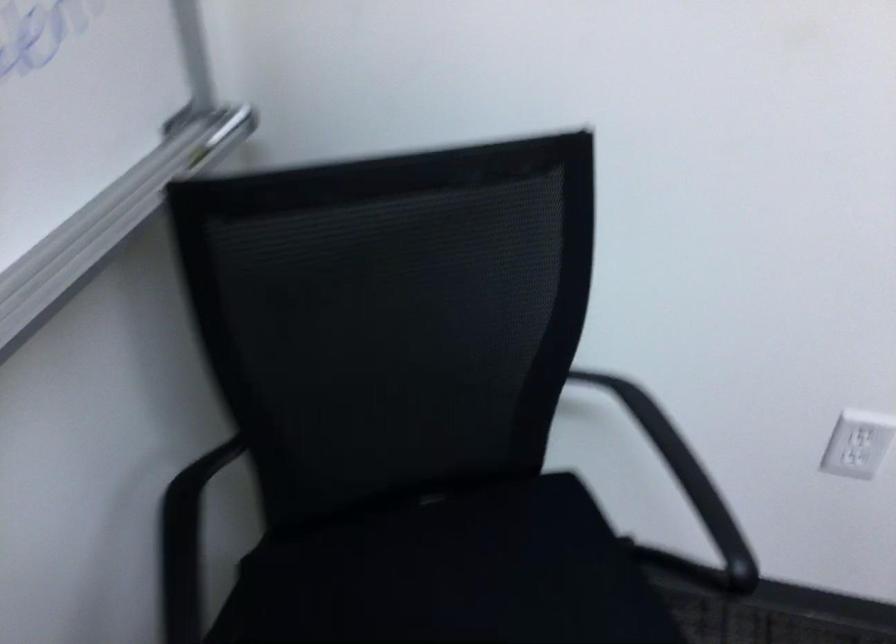
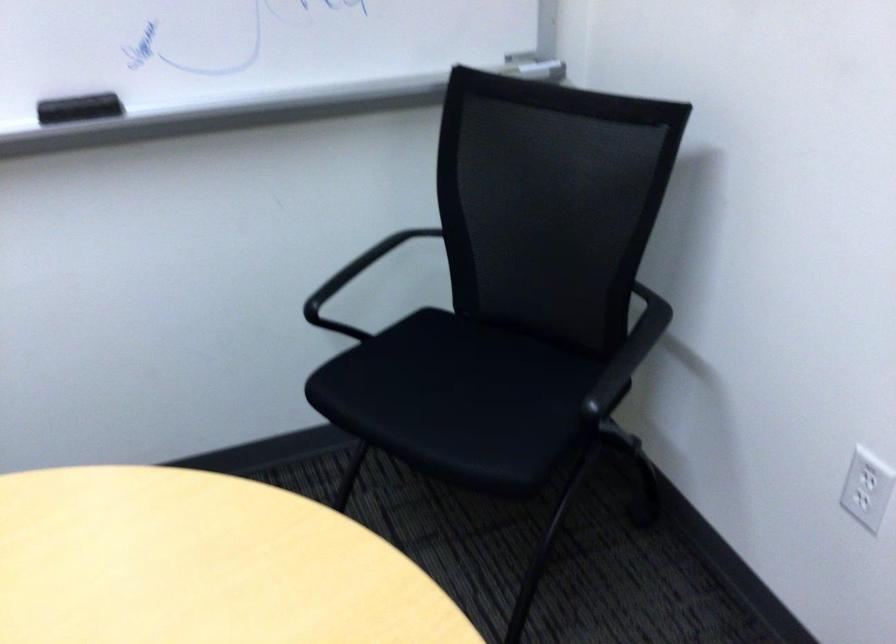
Find the pixel in the second image that matches point (547, 451) in the first image.

(673, 399)